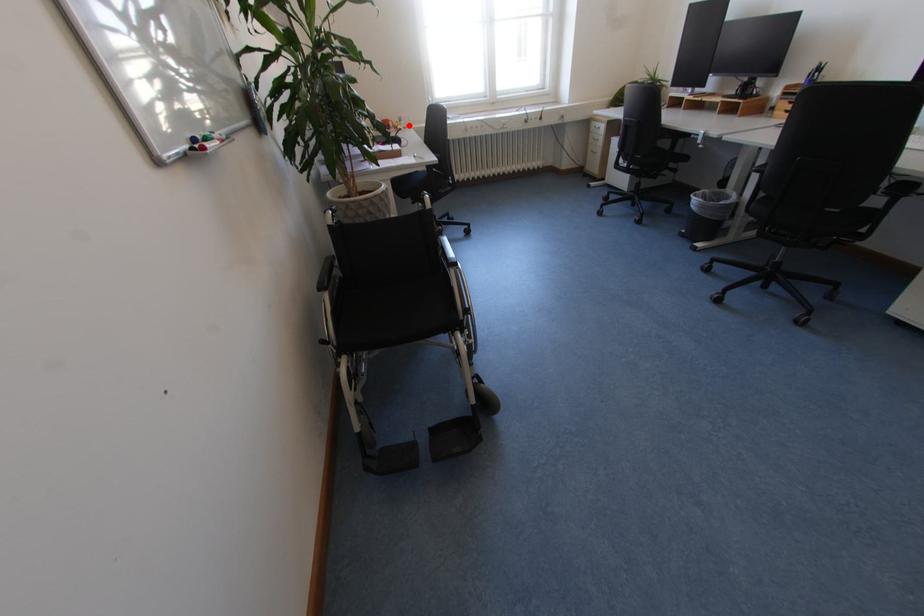
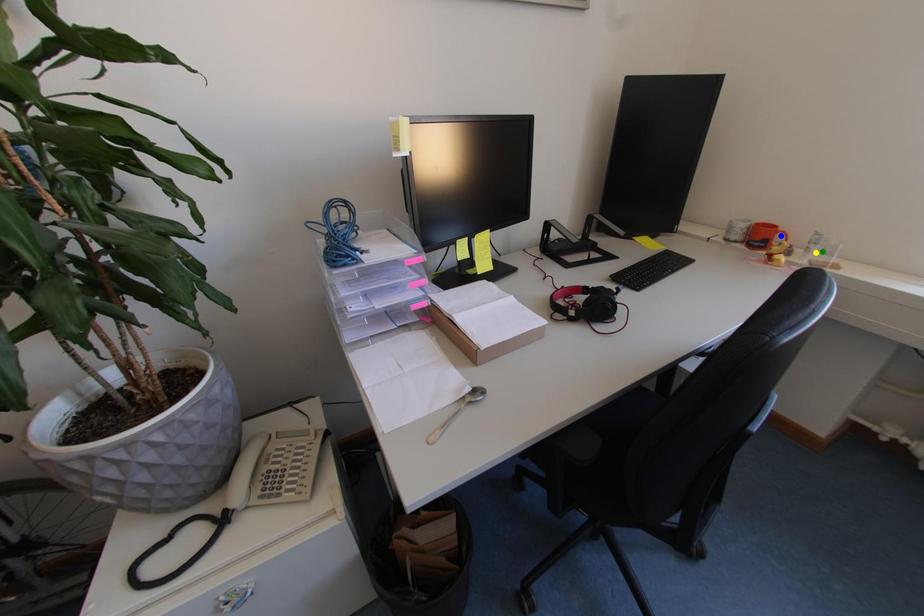
Question: I am providing you with two images of the same scene from different viewpoints. A red point is marked on the first image. You are given multiple points on the second image. Which point in image 2 is actually the same real-world point as the red point in image 1?

Choices:
 (A) yellow point
 (B) blue point
 (C) green point

Answer: (A)